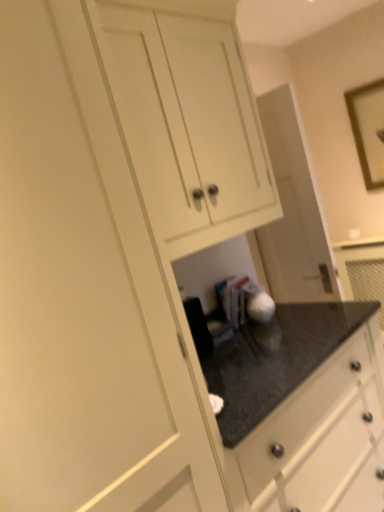
The image size is (384, 512). Find the location of `wooden framed picture at upper right`. wooden framed picture at upper right is located at coordinates (368, 130).

This screenshot has width=384, height=512. Describe the element at coordinates (368, 130) in the screenshot. I see `wooden framed picture at upper right` at that location.

Measure the distance between point (357, 134) and camera.

Point (357, 134) is 3.16 meters away from camera.

The height and width of the screenshot is (512, 384). Describe the element at coordinates (187, 125) in the screenshot. I see `white matte cabinet at upper center` at that location.

Where is `white matte cabinet at upper center`? white matte cabinet at upper center is located at coordinates (187, 125).

I want to click on wooden framed picture at upper right, so [368, 130].

In the scene shown: Is white matte cabinet at upper center at the right side of wooden framed picture at upper right?

No, white matte cabinet at upper center is not to the right of wooden framed picture at upper right.

Is white matte cabinet at upper center in front of or behind wooden framed picture at upper right in the image?

In the image, white matte cabinet at upper center appears in front of wooden framed picture at upper right.

Does point (179, 237) come in front of point (380, 151)?

Yes, it is in front of point (380, 151).

From the image's perspective, which one is positioned higher, white matte cabinet at upper center or wooden framed picture at upper right?

wooden framed picture at upper right.

From a real-world perspective, is white matte cabinet at upper center positioned above or below wooden framed picture at upper right?

In terms of real-world spatial position, white matte cabinet at upper center is above wooden framed picture at upper right.

Between white matte cabinet at upper center and wooden framed picture at upper right, which one has larger width?

Wider between the two is white matte cabinet at upper center.

Can you confirm if white matte cabinet at upper center is taller than wooden framed picture at upper right?

Indeed, white matte cabinet at upper center has a greater height compared to wooden framed picture at upper right.

Considering the relative sizes of white matte cabinet at upper center and wooden framed picture at upper right in the image provided, is white matte cabinet at upper center smaller than wooden framed picture at upper right?

Incorrect, white matte cabinet at upper center is not smaller in size than wooden framed picture at upper right.

Is white matte cabinet at upper center spatially inside wooden framed picture at upper right, or outside of it?

white matte cabinet at upper center is not enclosed by wooden framed picture at upper right.

Would you consider white matte cabinet at upper center to be distant from wooden framed picture at upper right?

Yes, white matte cabinet at upper center and wooden framed picture at upper right are located far from each other.

Is white matte cabinet at upper center oriented towards wooden framed picture at upper right?

No.

How different are the orientations of white matte cabinet at upper center and wooden framed picture at upper right in degrees?

The angle between the facing direction of white matte cabinet at upper center and the facing direction of wooden framed picture at upper right is 89.1 degrees.

In order to click on picture frame behind the white matte cabinet at upper center in this screenshot , I will do `click(368, 130)`.

Which is more to the right, wooden framed picture at upper right or white matte cabinet at upper center?

wooden framed picture at upper right is more to the right.

Considering the relative positions of wooden framed picture at upper right and white matte cabinet at upper center in the image provided, is wooden framed picture at upper right behind white matte cabinet at upper center?

Yes, it is behind white matte cabinet at upper center.

Is point (367, 86) farther from viewer compared to point (149, 109)?

Yes, it is behind point (149, 109).

Looking at this image, from the image's perspective, is wooden framed picture at upper right beneath white matte cabinet at upper center?

No, from the image's perspective, wooden framed picture at upper right is not beneath white matte cabinet at upper center.

From a real-world perspective, between wooden framed picture at upper right and white matte cabinet at upper center, who is vertically lower?

wooden framed picture at upper right.

In terms of width, does wooden framed picture at upper right look wider or thinner when compared to white matte cabinet at upper center?

In the image, wooden framed picture at upper right appears to be more narrow than white matte cabinet at upper center.

Considering the relative sizes of wooden framed picture at upper right and white matte cabinet at upper center in the image provided, is wooden framed picture at upper right shorter than white matte cabinet at upper center?

Indeed, wooden framed picture at upper right has a lesser height compared to white matte cabinet at upper center.

Looking at this image, does wooden framed picture at upper right have a larger size compared to white matte cabinet at upper center?

No, wooden framed picture at upper right is not bigger than white matte cabinet at upper center.

Can white matte cabinet at upper center be found inside wooden framed picture at upper right?

No, white matte cabinet at upper center is not surrounded by wooden framed picture at upper right.

Does wooden framed picture at upper right touch white matte cabinet at upper center?

There is a gap between wooden framed picture at upper right and white matte cabinet at upper center.

Is wooden framed picture at upper right oriented towards white matte cabinet at upper center?

Yes, wooden framed picture at upper right is turned towards white matte cabinet at upper center.

What's the angular difference between wooden framed picture at upper right and white matte cabinet at upper center's facing directions?

There is a 89.1-degree angle between the facing directions of wooden framed picture at upper right and white matte cabinet at upper center.

Locate an element on the screen. cabinetry on the left side of wooden framed picture at upper right is located at coordinates (187, 125).

Find the location of `picture frame behind the white matte cabinet at upper center`. picture frame behind the white matte cabinet at upper center is located at coordinates (368, 130).

Where is `cabinetry lying below the wooden framed picture at upper right (from the image's perspective)`? The image size is (384, 512). cabinetry lying below the wooden framed picture at upper right (from the image's perspective) is located at coordinates tap(187, 125).